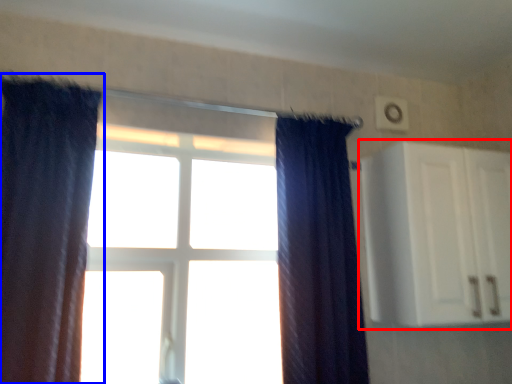
Question: Which of the following is the farthest to the observer, cabinetry (highlighted by a red box) or curtain (highlighted by a blue box)?

Choices:
 (A) cabinetry
 (B) curtain

Answer: (A)